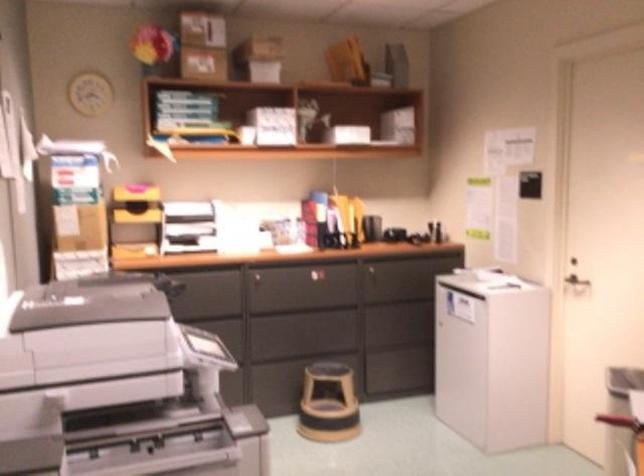
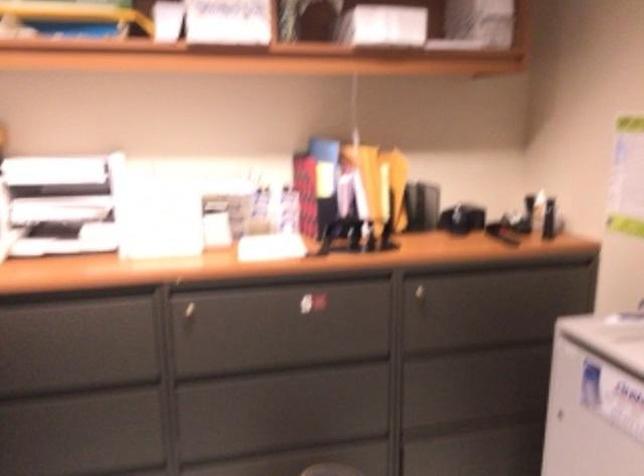
Locate, in the second image, the point that corresponds to (196,294) in the first image.

(70, 336)